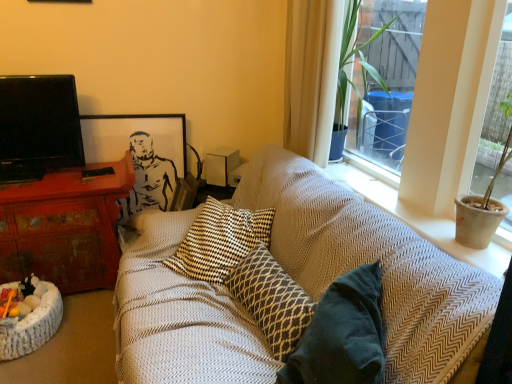
Question: Is white sheer curtain at upper right to the left or to the right of woven fabric cat bed at lower left in the image?

Choices:
 (A) right
 (B) left

Answer: (A)

Question: Is white sheer curtain at upper right situated inside woven fabric cat bed at lower left or outside?

Choices:
 (A) inside
 (B) outside

Answer: (B)

Question: Which is nearer to the woven fabric cat bed at lower left?

Choices:
 (A) white matte speaker at upper center
 (B) black matte picture frame at upper left
 (C) textured beige cushion at upper right
 (D) black glossy tv at left
 (E) white sheer curtain at upper right

Answer: (D)

Question: Estimate the real-world distances between objects in this image. Which object is farther from the patterned fabric pillow at center?

Choices:
 (A) black matte picture frame at upper left
 (B) textured beige cushion at upper right
 (C) white sheer curtain at upper right
 (D) black glossy tv at left
 (E) woven fabric cat bed at lower left

Answer: (D)